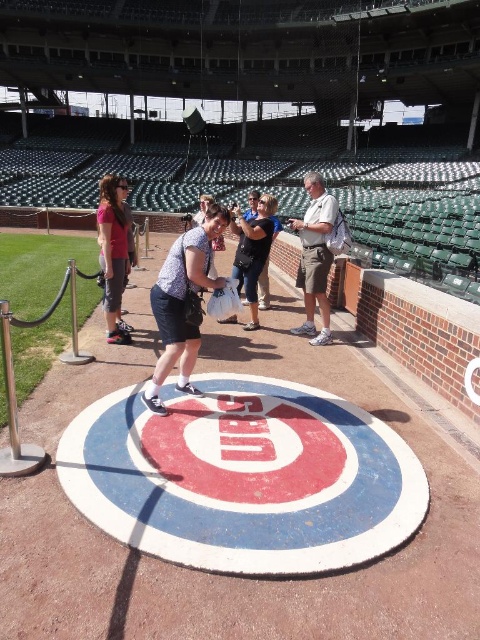
You are a photographer at the baseball stadium and need to position two subjects wearing the matte blue shorts at center and khaki shorts at center. Since you want to emphasize the wider subject, which one should you place on the left side of the frame to avoid overcrowding?

The matte blue shorts at center is wider than the khaki shorts at center. To avoid overcrowding, place the matte blue shorts at center on the left side of the frame since it is wider and will balance the composition better.

You are a photographer at the baseball stadium and need to capture a wide shot of the logo. You have two people in your frame wearing a matte pink shirt at left and denim shorts at center. Which clothing item is narrower in your photo?

The matte pink shirt at left is thinner than the denim shorts at center, so the matte pink shirt at left is narrower in the photo.

You are a photographer trying to capture a clear shot of the logo. You notice the khaki shorts at center and the matte pink shirt at left are blocking the view. Which clothing item should you ask to move to ensure the logo is fully visible?

The khaki shorts at center might be wider than matte pink shirt at left, so you should ask the person wearing the khaki shorts at center to move since it is wider and blocking more of the logo.